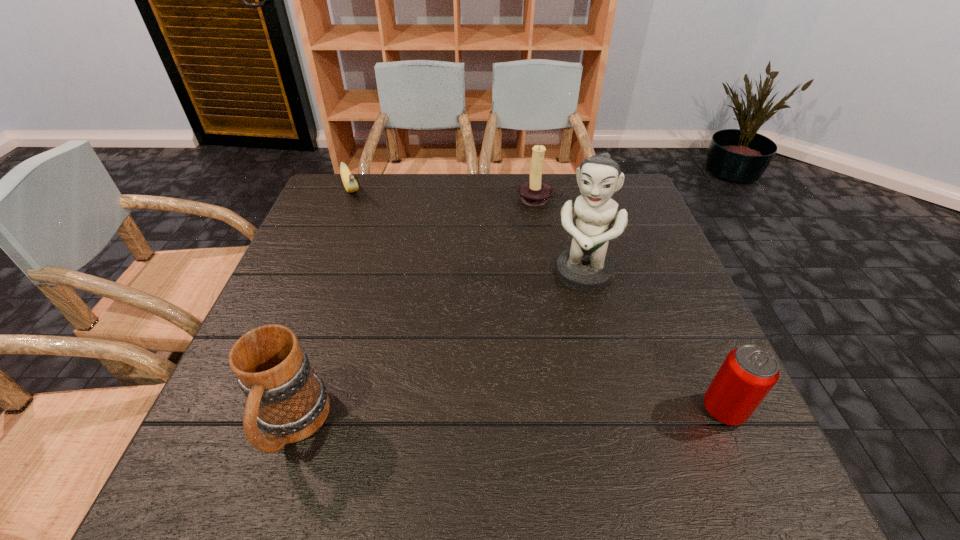
Image resolution: width=960 pixels, height=540 pixels. Identify the location of vacant space at the left edge of the desktop. (307, 308).

This screenshot has height=540, width=960. What are the coordinates of `free space at the right edge of the desktop` in the screenshot? It's located at (710, 365).

In the image, there is a desktop. Identify the location of vacant area at the near left corner. The height and width of the screenshot is (540, 960). (236, 410).

Where is `free spot at the far right corner of the desktop`? This screenshot has width=960, height=540. free spot at the far right corner of the desktop is located at coordinates (624, 197).

Identify the location of vacant space that's between the third farthest object and the fourth tallest object. The image size is (960, 540). (653, 342).

The height and width of the screenshot is (540, 960). In order to click on vacant space that's between the mug and the shortest object in this screenshot , I will do `click(322, 308)`.

Locate an element on the screen. This screenshot has height=540, width=960. free space between the second shortest object and the figurine is located at coordinates (653, 342).

Find the location of a particular element. free space that is in between the figurine and the candle holder is located at coordinates (561, 237).

You are a GUI agent. You are given a task and a screenshot of the screen. Output one action in this format:
    pyautogui.click(x=<x>, y=<y>)
    Task: Click on the free space that is in between the candle holder and the mug
    This screenshot has width=960, height=540.
    Given the screenshot: What is the action you would take?
    pyautogui.click(x=416, y=312)

Where is `vacant point located between the can and the candle holder`? This screenshot has height=540, width=960. vacant point located between the can and the candle holder is located at coordinates (631, 304).